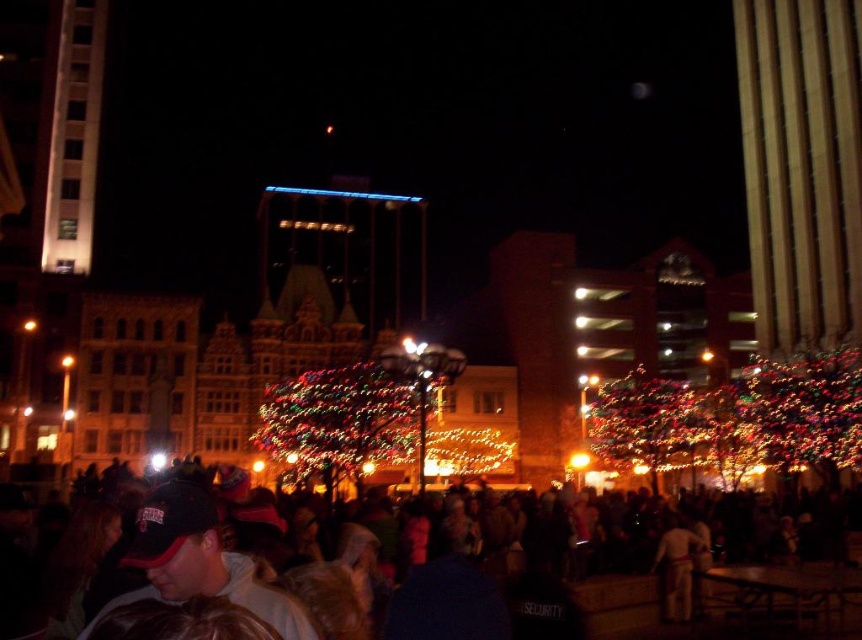
Question: Which point is farther to the camera?

Choices:
 (A) (670, 608)
 (B) (222, 588)
 (C) (319, 401)

Answer: (C)

Question: Which is farther from the illuminated plastic tree at center?

Choices:
 (A) illuminated glass tree at center
 (B) dark clothing crowd at center
 (C) dark blue fabric cap at lower left
 (D) light brown leather jacket at lower right

Answer: (D)

Question: Does dark clothing crowd at center come in front of dark blue fabric cap at lower left?

Choices:
 (A) no
 (B) yes

Answer: (B)

Question: Does illuminated glass tree at center have a greater width compared to light brown leather jacket at lower right?

Choices:
 (A) yes
 (B) no

Answer: (A)

Question: Can you confirm if illuminated glass tree at center is positioned below light brown leather jacket at lower right?

Choices:
 (A) no
 (B) yes

Answer: (A)

Question: Which object is the closest to the dark blue fabric cap at lower left?

Choices:
 (A) dark clothing crowd at center
 (B) illuminated glass tree at center

Answer: (A)